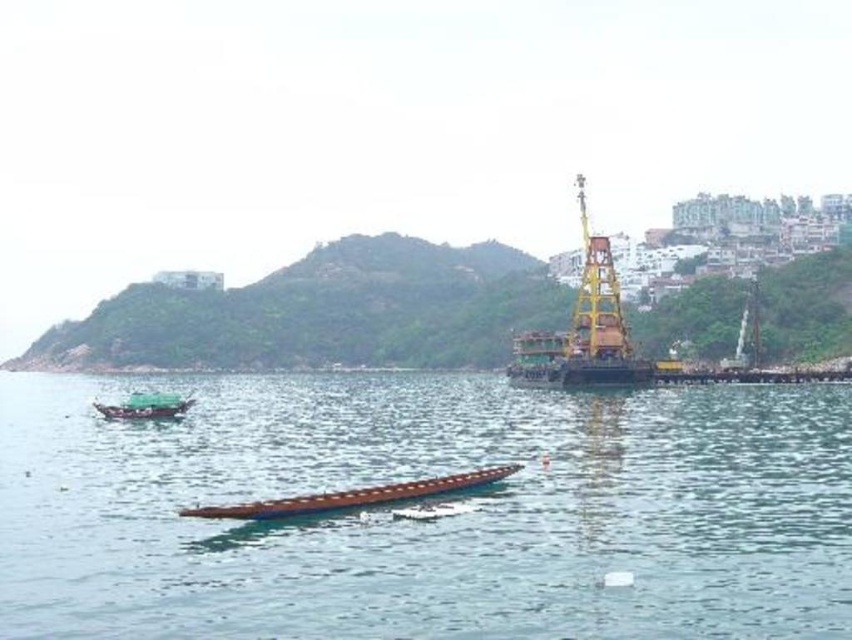
Question: Does brown wooden plank at center appear under green grassy hillside at upper center?

Choices:
 (A) yes
 (B) no

Answer: (A)

Question: Which point appears closest to the camera in this image?

Choices:
 (A) (315, 438)
 (B) (383, 342)
 (C) (511, 470)

Answer: (C)

Question: Which object is farther from the camera taking this photo?

Choices:
 (A) green matte boat at left
 (B) green grassy hillside at upper center
 (C) brown wooden plank at center
 (D) brown wooden canoe at center

Answer: (B)

Question: Does green grassy hillside at upper center appear on the right side of green matte boat at left?

Choices:
 (A) no
 (B) yes

Answer: (B)

Question: Which object is farther from the camera taking this photo?

Choices:
 (A) green grassy hillside at upper center
 (B) green matte boat at left
 (C) brown wooden canoe at center
 (D) brown wooden plank at center

Answer: (A)

Question: Is brown wooden canoe at center smaller than green matte boat at left?

Choices:
 (A) no
 (B) yes

Answer: (B)